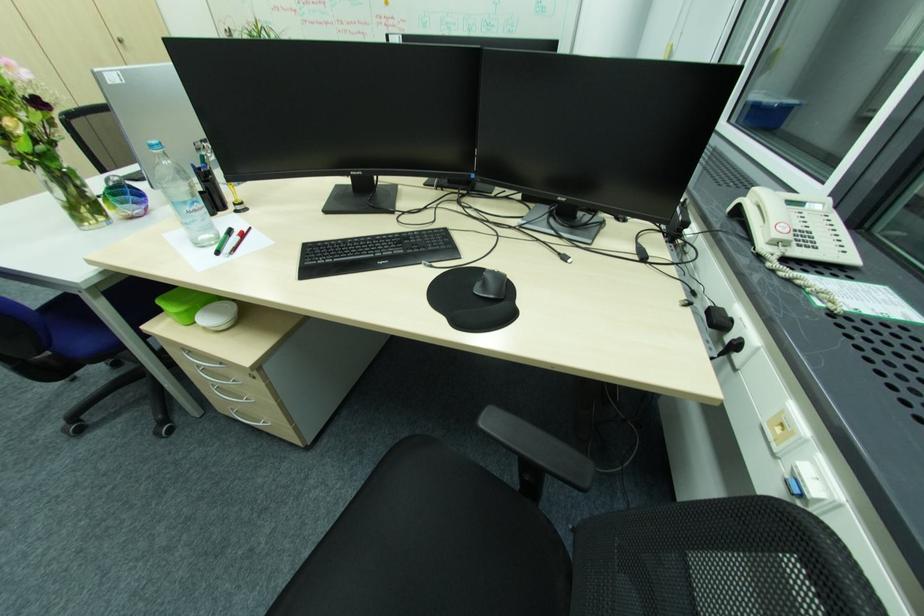
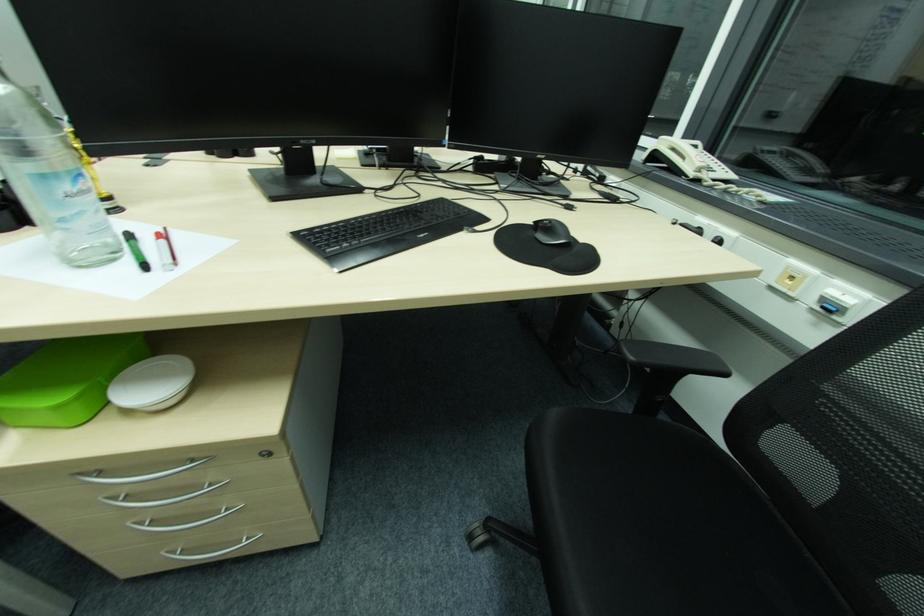
Question: The first image is from the beginning of the video and the second image is from the end. How did the camera likely rotate when shooting the video?

Choices:
 (A) Left
 (B) Right
 (C) Up
 (D) Down

Answer: (B)